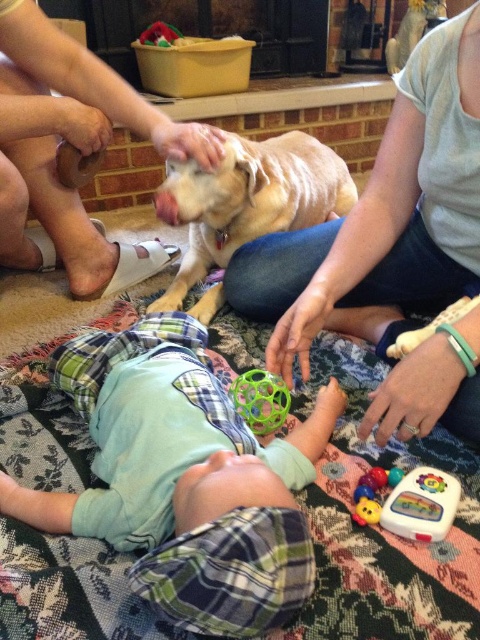
Question: Can you confirm if translucent rubber ball at center is wider than rubberized plastic toy at lower right?

Choices:
 (A) no
 (B) yes

Answer: (B)

Question: Which object is closer to the camera taking this photo?

Choices:
 (A) rubberized plastic remote at lower right
 (B) rubberized plastic toy at lower right

Answer: (A)

Question: Does green rubber ball at center come behind light blue cotton shirt at center?

Choices:
 (A) no
 (B) yes

Answer: (A)

Question: Is green rubber ball at center to the left of light blue cotton shirt at center from the viewer's perspective?

Choices:
 (A) no
 (B) yes

Answer: (B)

Question: Which point is farther to the camera?

Choices:
 (A) rubber teething ring at lower center
 (B) light brown fur at center

Answer: (B)

Question: Which point is farther to the camera?

Choices:
 (A) translucent rubber ball at center
 (B) light blue cotton shirt at center
 (C) rubberized plastic remote at lower right

Answer: (A)